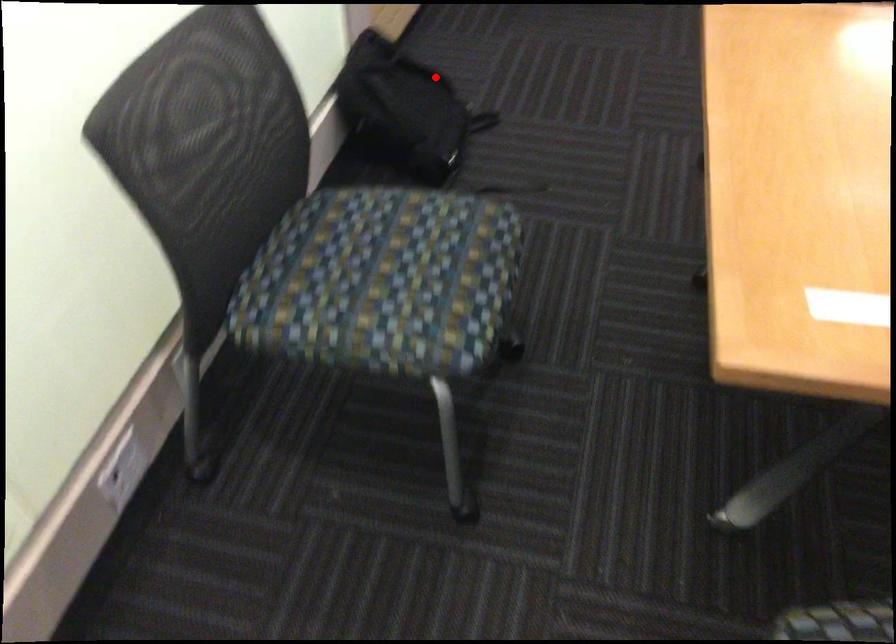
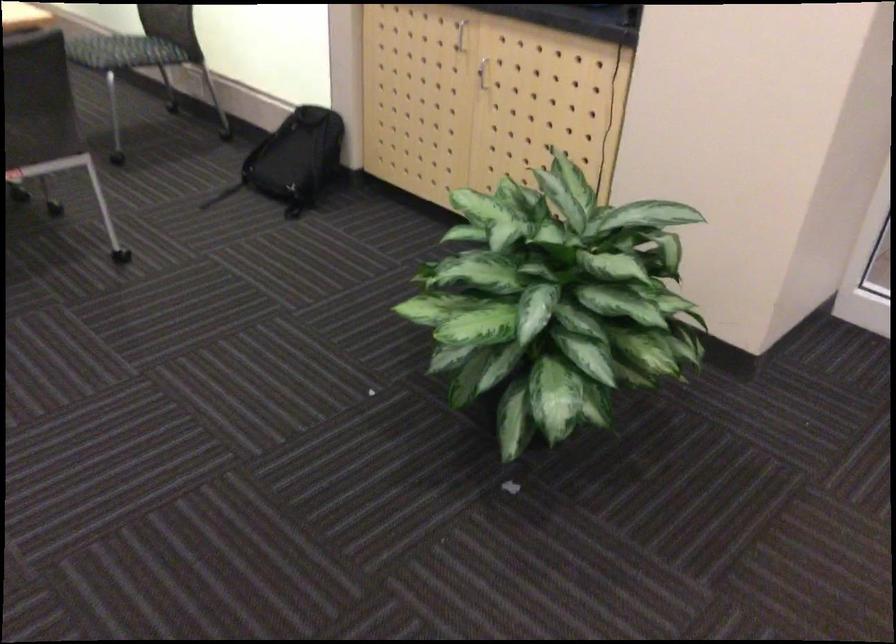
Question: I am providing you with two images of the same scene from different viewpoints. A red point is marked on the first image. At the location where the point appears in image 1, is it still visible in image 2?

Choices:
 (A) Yes
 (B) No

Answer: (A)